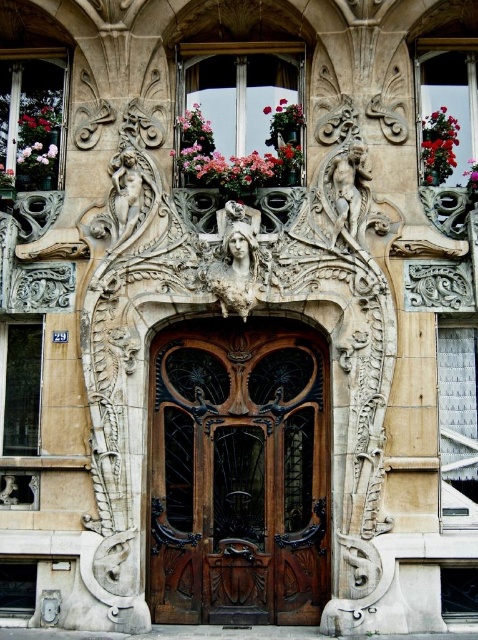
Does dark brown wood door at center have a lesser width compared to pink matte flower at center?

In fact, dark brown wood door at center might be wider than pink matte flower at center.

The height and width of the screenshot is (640, 478). What do you see at coordinates (239, 472) in the screenshot?
I see `dark brown wood door at center` at bounding box center [239, 472].

This screenshot has height=640, width=478. What do you see at coordinates (239, 472) in the screenshot?
I see `dark brown wood door at center` at bounding box center [239, 472].

What are the coordinates of `dark brown wood door at center` in the screenshot? It's located at (239, 472).

Measure the distance between dark brown wood door at center and clear glass window at center.

dark brown wood door at center and clear glass window at center are 8.92 meters apart.

Can you confirm if dark brown wood door at center is wider than clear glass window at center?

Indeed, dark brown wood door at center has a greater width compared to clear glass window at center.

Is point (213, 604) behind point (442, 442)?

Yes, it is.

Locate an element on the screen. This screenshot has height=640, width=478. dark brown wood door at center is located at coordinates [239, 472].

Consider the image. Is clear glass window at center in front of matte gray metal window at lower left?

Yes, it is.

The height and width of the screenshot is (640, 478). In order to click on clear glass window at center in this screenshot , I will do `click(457, 424)`.

Identify the location of clear glass window at center. (457, 424).